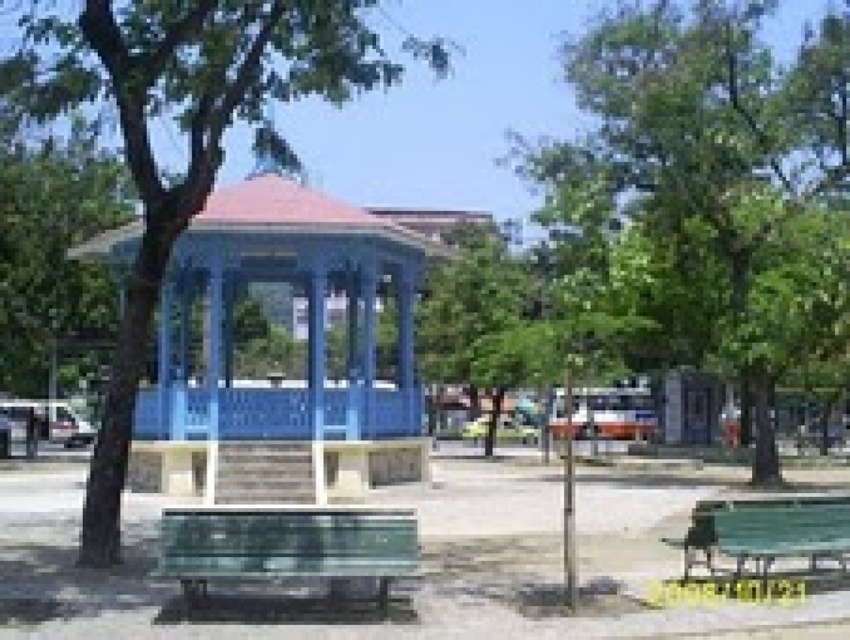
Question: Among these objects, which one is farthest from the camera?

Choices:
 (A) green plastic bench at lower right
 (B) green leafy tree at left
 (C) blue painted wood gazebo at center
 (D) green plastic bench at lower center

Answer: (B)

Question: Which of these objects is positioned farthest from the green leafy tree at center?

Choices:
 (A) blue painted wood gazebo at center
 (B) green leafy tree at left
 (C) green wood tree at center
 (D) green plastic bench at lower right

Answer: (B)

Question: Which is nearer to the green plastic bench at lower center?

Choices:
 (A) blue painted wood gazebo at center
 (B) green wood tree at center
 (C) green plastic bench at lower right
 (D) green leafy tree at left

Answer: (C)

Question: Does blue painted wood gazebo at center appear under green wood tree at center?

Choices:
 (A) no
 (B) yes

Answer: (B)

Question: In this image, where is blue painted wood gazebo at center located relative to green plastic bench at lower right?

Choices:
 (A) above
 (B) below

Answer: (A)

Question: From the image, what is the correct spatial relationship of green leafy tree at center in relation to green plastic bench at lower right?

Choices:
 (A) left
 (B) right

Answer: (B)